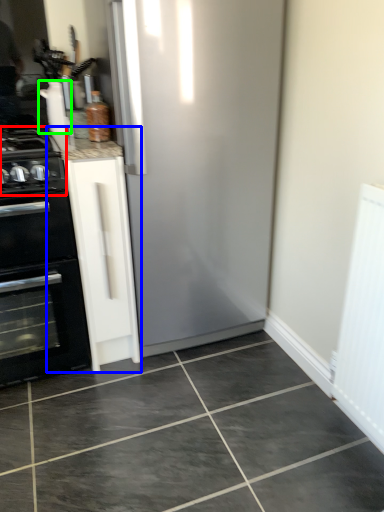
Question: Which is nearer to the gas stove (highlighted by a red box)? cabinetry (highlighted by a blue box) or appliance (highlighted by a green box).

Choices:
 (A) cabinetry
 (B) appliance

Answer: (A)